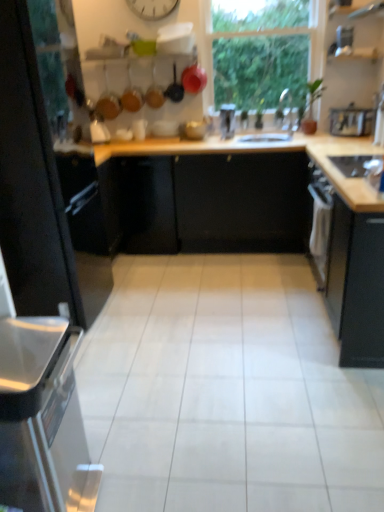
This screenshot has width=384, height=512. Find the location of `vacant space underneath metallic silver toaster at upper right, the 1th appliance positioned from the top (from a real-world perspective)`. vacant space underneath metallic silver toaster at upper right, the 1th appliance positioned from the top (from a real-world perspective) is located at coordinates (337, 52).